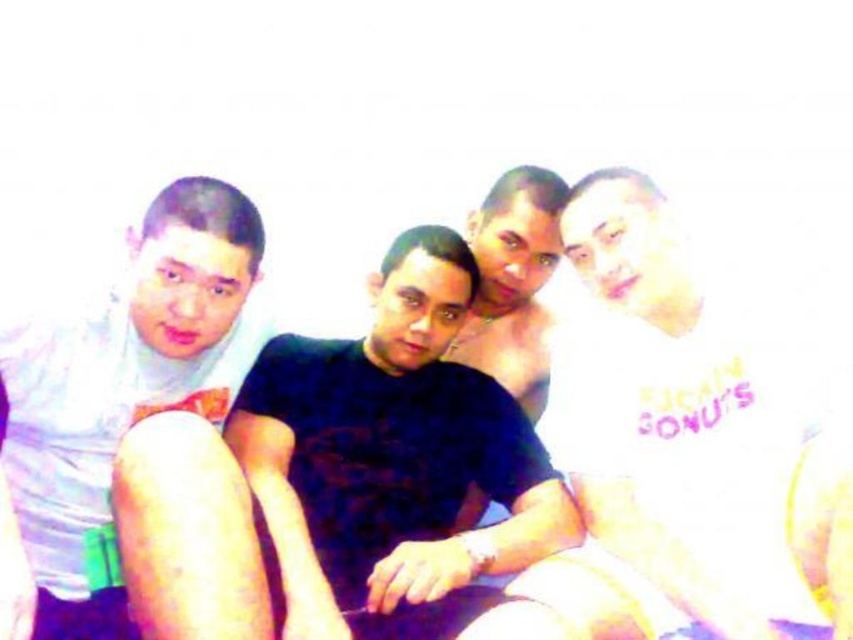
Question: In this image, where is black matte shirt at center located relative to white matte shirt at left?

Choices:
 (A) above
 (B) below

Answer: (B)

Question: Which point is farther from the camera taking this photo?

Choices:
 (A) (368, 476)
 (B) (142, 252)

Answer: (A)

Question: Does black matte shirt at center appear on the right side of white matte shirt at left?

Choices:
 (A) yes
 (B) no

Answer: (A)

Question: Is black matte shirt at center further to camera compared to white matte shirt at left?

Choices:
 (A) no
 (B) yes

Answer: (A)

Question: Among these objects, which one is nearest to the camera?

Choices:
 (A) black matte shirt at center
 (B) white matte shirt at left

Answer: (A)